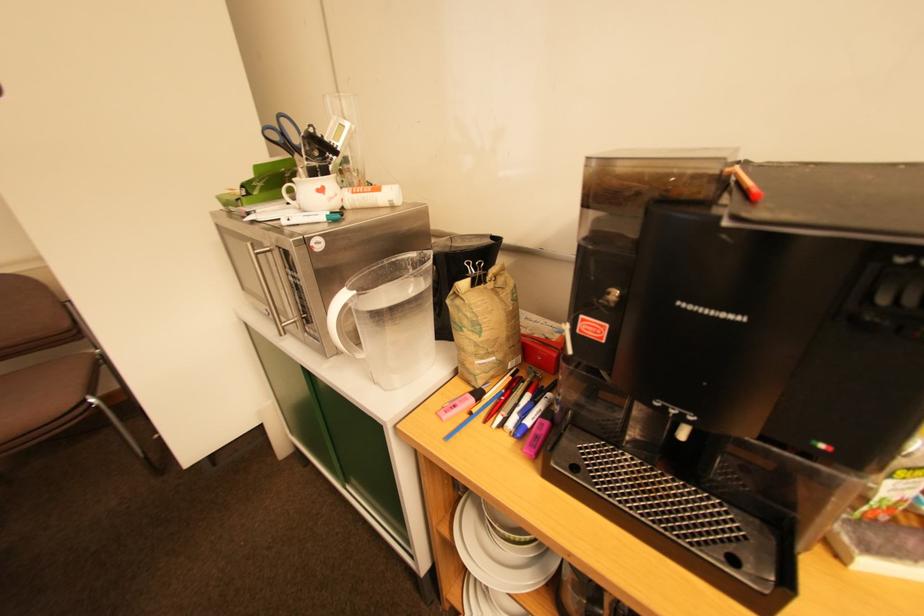
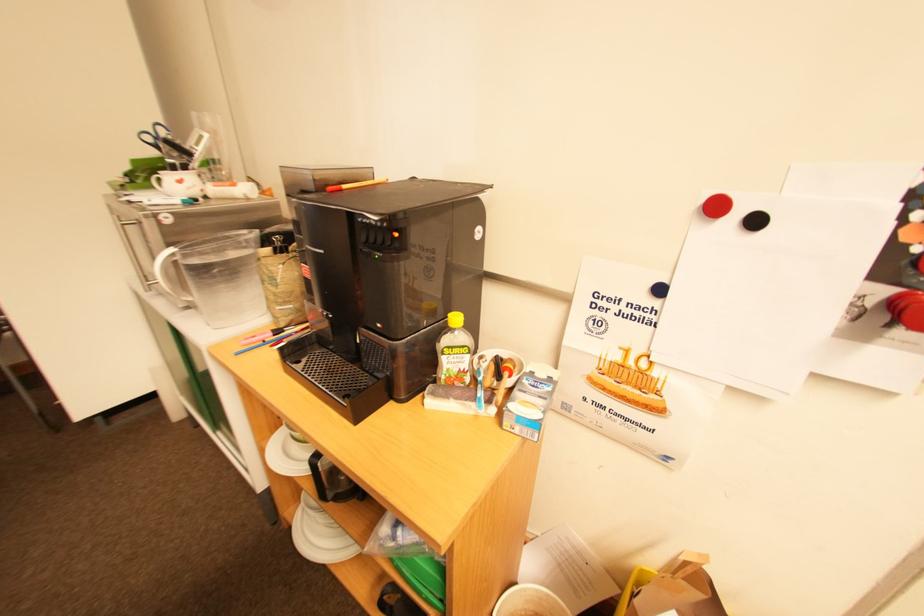
Question: The camera is either moving clockwise (left) or counter-clockwise (right) around the object. The first image is from the beginning of the video and the second image is from the end. Is the camera moving left or right when shooting the video?

Choices:
 (A) Left
 (B) Right

Answer: (A)